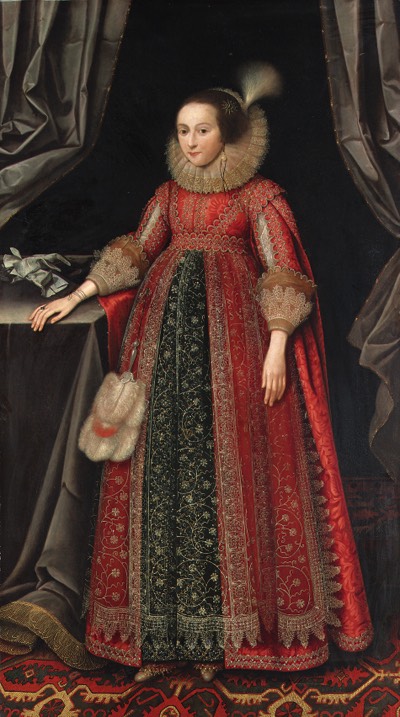
Identify the location of black, yellow and red carpering. This screenshot has width=400, height=717. (98, 687).